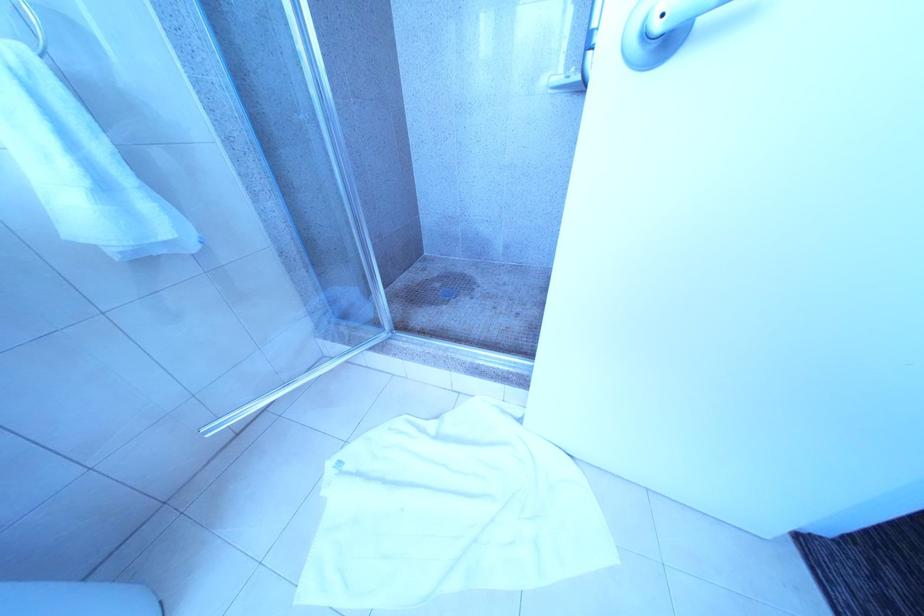
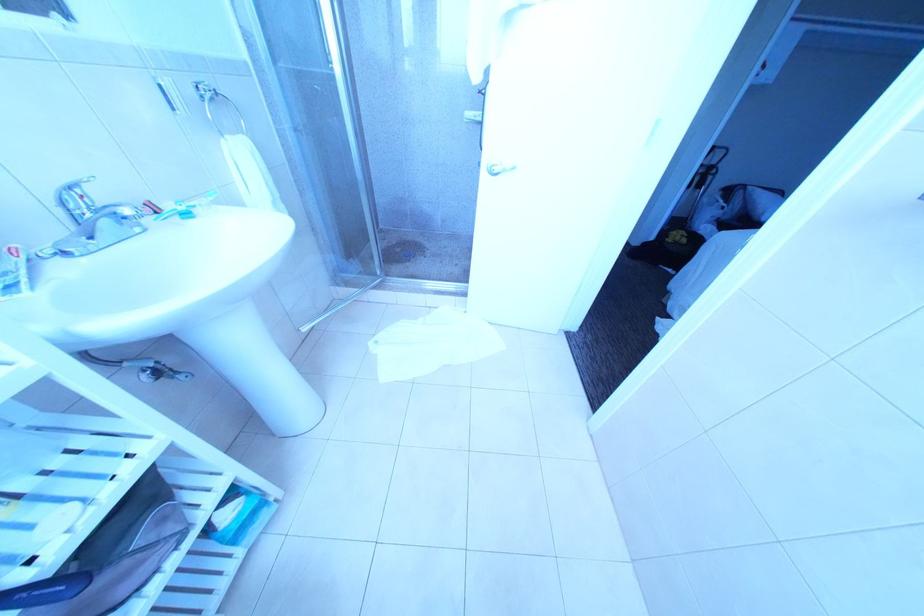
In a continuous first-person perspective shot, in which direction is the camera moving?

The cameraman walked toward left, backward.